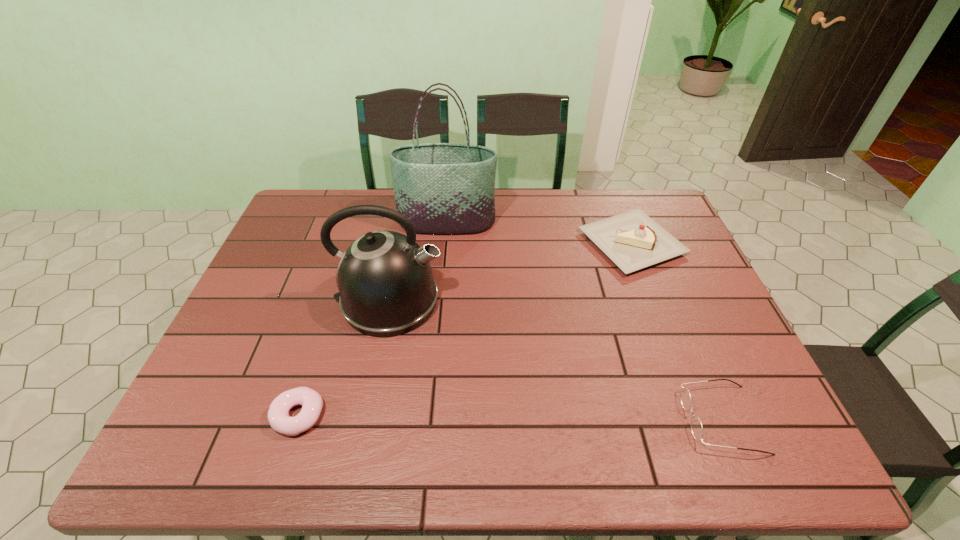
The height and width of the screenshot is (540, 960). I want to click on free space between the second tallest object and the shortest object, so click(344, 358).

Image resolution: width=960 pixels, height=540 pixels. What are the coordinates of `vacant space in between the spectacles and the cake` in the screenshot? It's located at (677, 331).

I want to click on unoccupied area between the third shortest object and the second tallest object, so click(511, 272).

Where is `free area in between the tallest object and the third tallest object`? This screenshot has width=960, height=540. free area in between the tallest object and the third tallest object is located at coordinates (540, 233).

The width and height of the screenshot is (960, 540). I want to click on object that is the closest to the doughnut, so click(386, 286).

Locate which object is the third closest to the kettle. Please provide its 2D coordinates. Your answer should be formatted as a tuple, i.e. [(x, y)], where the tuple contains the x and y coordinates of a point satisfying the conditions above.

[(632, 240)]

Where is `free spot that satisfies the following two spatial constraints: 1. on the spout of the kettle; 2. on the front side of the shortest object`? This screenshot has height=540, width=960. free spot that satisfies the following two spatial constraints: 1. on the spout of the kettle; 2. on the front side of the shortest object is located at coordinates (367, 415).